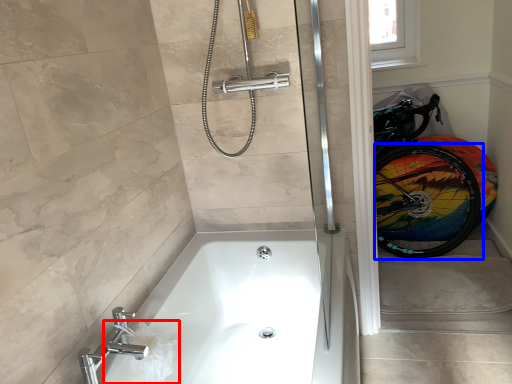
Question: Which of the following is the closest to the observer, toilet paper (highlighted by a red box) or bicycle wheel (highlighted by a blue box)?

Choices:
 (A) toilet paper
 (B) bicycle wheel

Answer: (A)